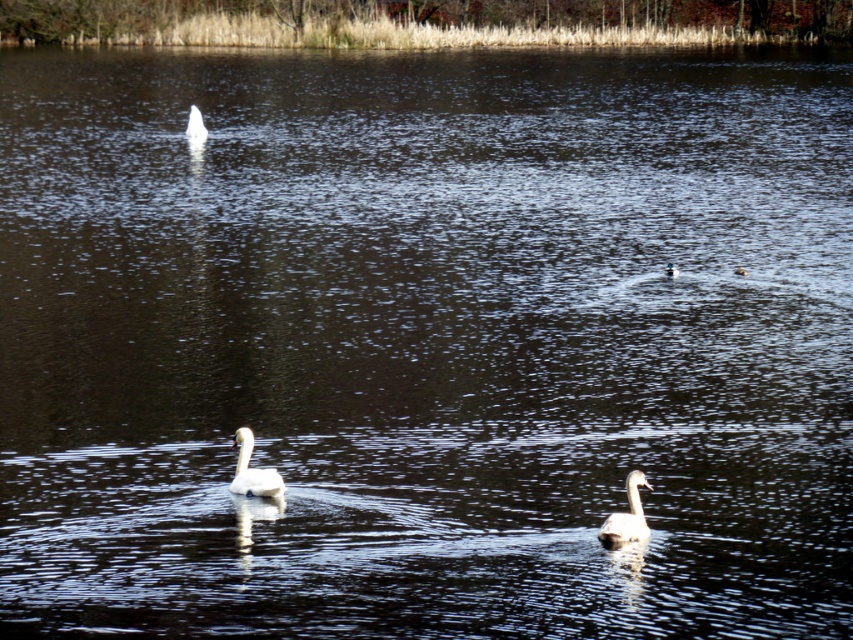
You are a photographer trying to capture both white matte swan at lower right and white matte swan at center in a single shot. Based on their sizes in the image, which swan would appear smaller in the photo?

The white matte swan at lower right has a lesser width compared to the white matte swan at center, so it would appear smaller in the photo.

You are a photographer trying to capture the swans in the scene. You want to take a photo where the white matte swan at lower right and the white matte swan at center are both visible. Which swan will appear smaller in the photo?

The white matte swan at lower right will appear smaller in the photo because it is shorter than the white matte swan at center.

You are a photographer trying to capture a clear shot of the white matte swan at center and the white glossy duck at upper center. Which one will appear larger in your photo?

The white matte swan at center will appear larger in the photo because it is closer to the viewer than the white glossy duck at upper center.